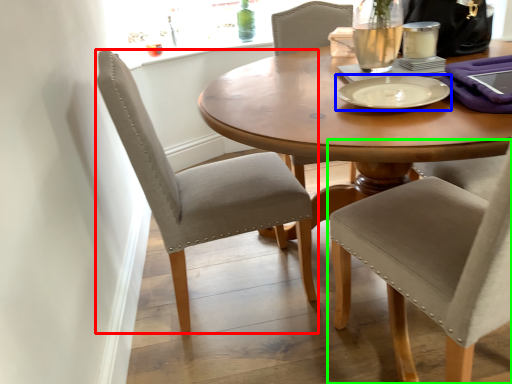
Question: Which object is the closest to the chair (highlighted by a red box)? Choose among these: tableware (highlighted by a blue box) or chair (highlighted by a green box).

Choices:
 (A) tableware
 (B) chair

Answer: (B)